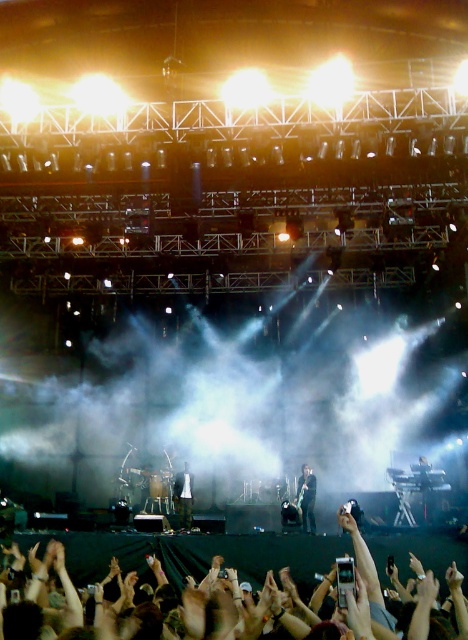
You are at a concert and want to take a photo of both the shiny black jacket at center and the matte black guitar at center. Which object will appear taller in your photo?

The shiny black jacket at center will appear taller in the photo since it has a greater height compared to the matte black guitar at center.

Looking at this image, you are a photographer at the concert and want to take a closeup shot of the shiny black jacket at center. According to the coordinates given, where should you aim your camera?

The shiny black jacket at center is located at coordinates point (307,497), so you should aim your camera at that position to capture it closely.

In the scene shown: You are a photographer at the concert. You want to take a photo focusing on the shiny black jacket at center and the matte black guitar at center. Which object should you zoom in on to capture more details without cropping the other object?

The shiny black jacket at center is smaller than the matte black guitar at center, so to capture more details without cropping, you should zoom in on the shiny black jacket at center since it requires closer focus due to its smaller size.